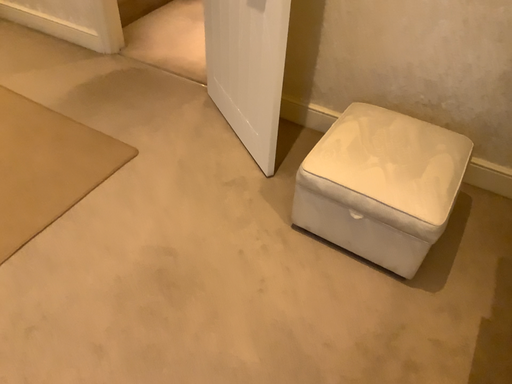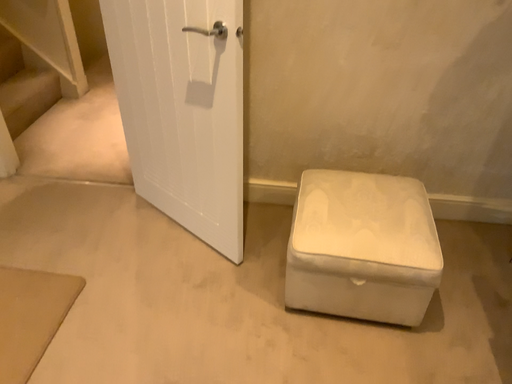
Question: Which way did the camera rotate in the video?

Choices:
 (A) rotated upward
 (B) rotated downward

Answer: (A)